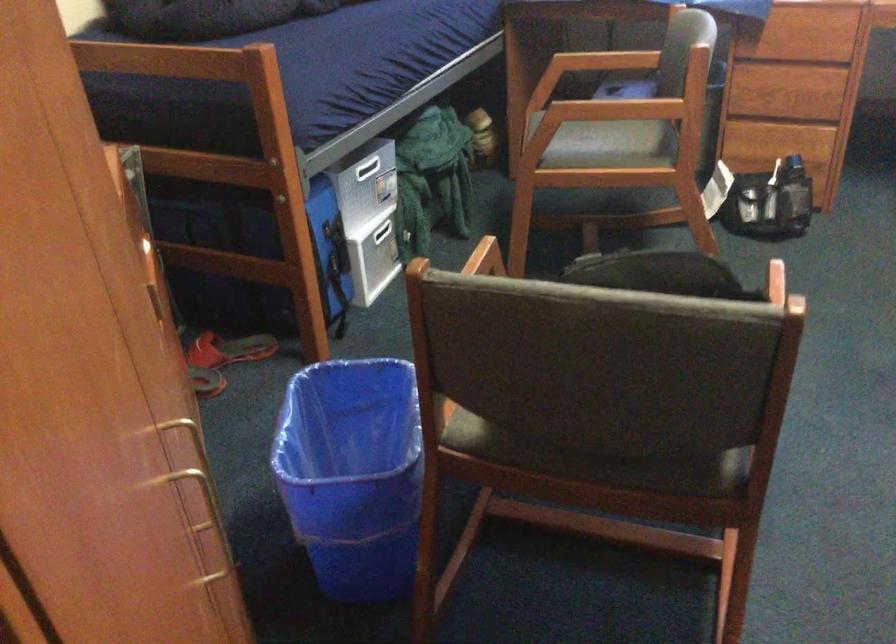
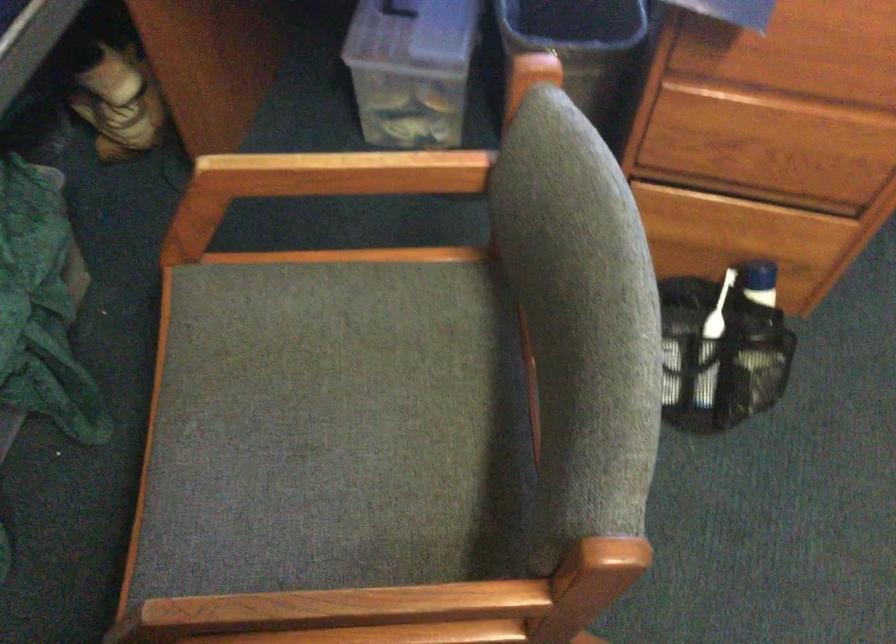
In the second image, find the point that corresponds to (x=782, y=178) in the first image.

(719, 308)